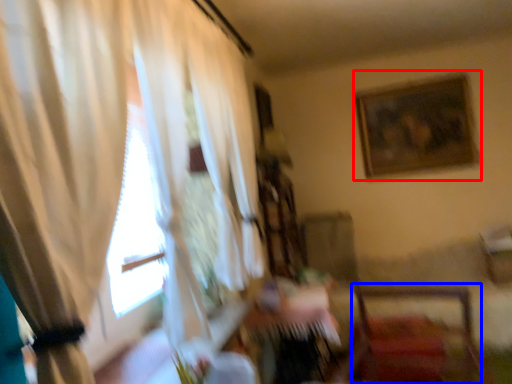
Question: Which of the following is the farthest to the observer, picture frame (highlighted by a red box) or chair (highlighted by a blue box)?

Choices:
 (A) picture frame
 (B) chair

Answer: (A)